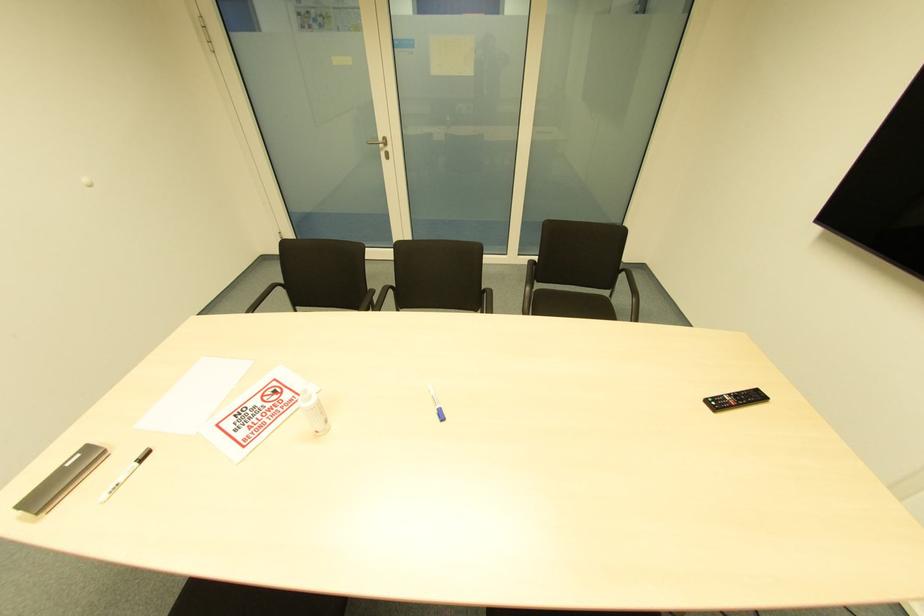
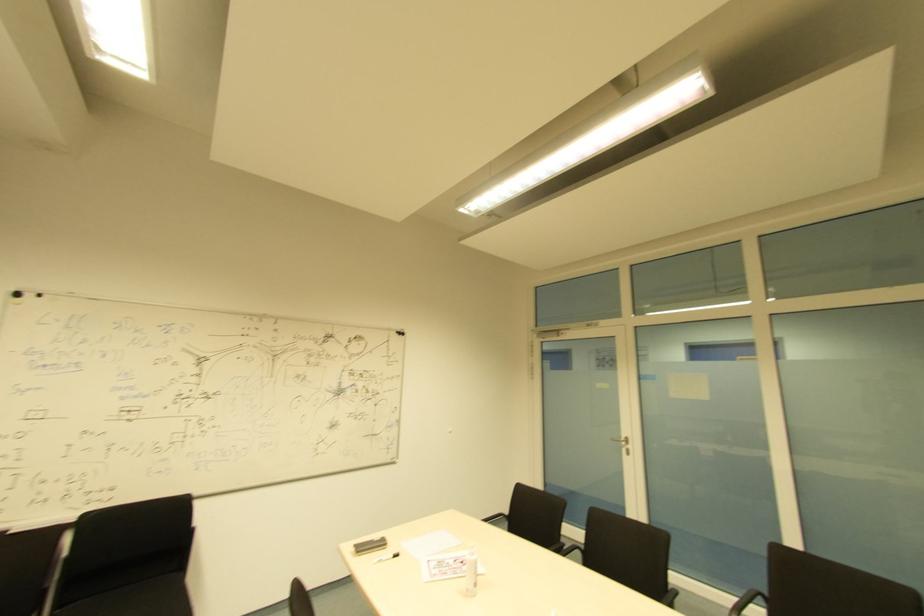
Locate, in the second image, the point that corresponds to [386,152] in the first image.

(628, 450)